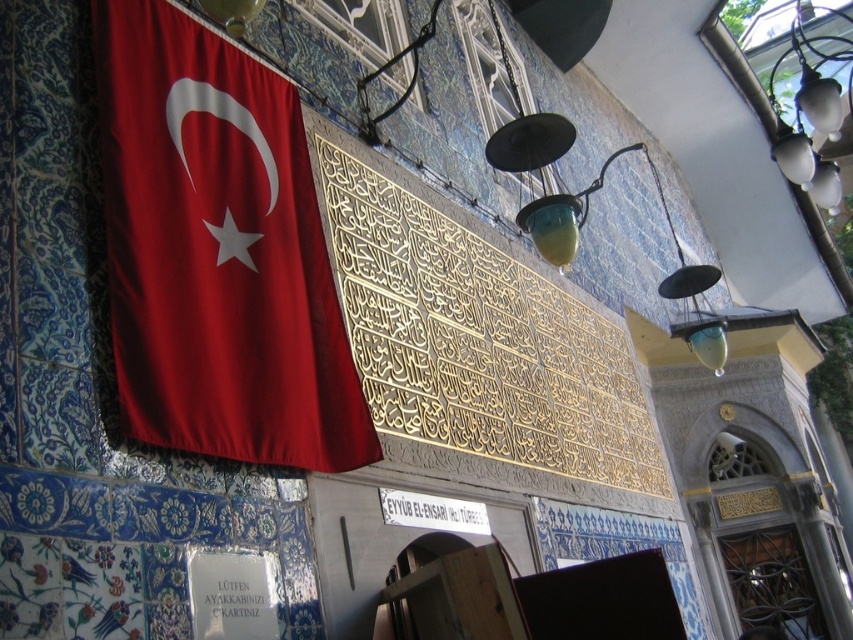
Question: Which object is the farthest from the velvet red flag at left?

Choices:
 (A) white paper sign at lower left
 (B) white paper sign at lower center
 (C) translucent glass lamp at upper right

Answer: (C)

Question: Which object appears closest to the camera in this image?

Choices:
 (A) white metallic sign at center
 (B) velvet red flag at left
 (C) translucent glass lamp at upper right
 (D) white paper sign at lower left

Answer: (B)

Question: Considering the relative positions of white paper sign at lower center and white metallic sign at center in the image provided, where is white paper sign at lower center located with respect to white metallic sign at center?

Choices:
 (A) right
 (B) left

Answer: (B)

Question: Is white paper sign at lower center above white paper sign at lower left?

Choices:
 (A) no
 (B) yes

Answer: (A)

Question: Which object is positioned closest to the velvet red flag at left?

Choices:
 (A) white metallic sign at center
 (B) white paper sign at lower center
 (C) translucent glass lamp at upper right

Answer: (B)

Question: Is velvet red flag at left bigger than white paper sign at lower center?

Choices:
 (A) no
 (B) yes

Answer: (B)